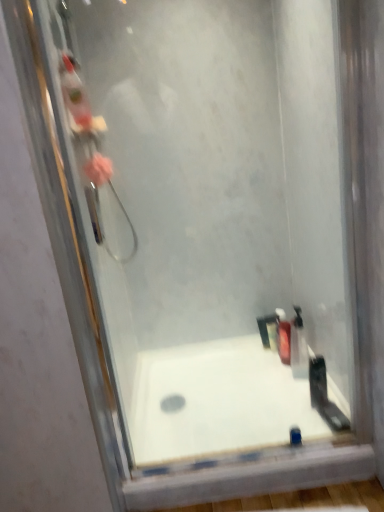
The image size is (384, 512). What are the coordinates of `free space in front of translucent plastic soap dispenser at lower right, placed as the first toiletry when sorted from back to front` in the screenshot? It's located at (278, 380).